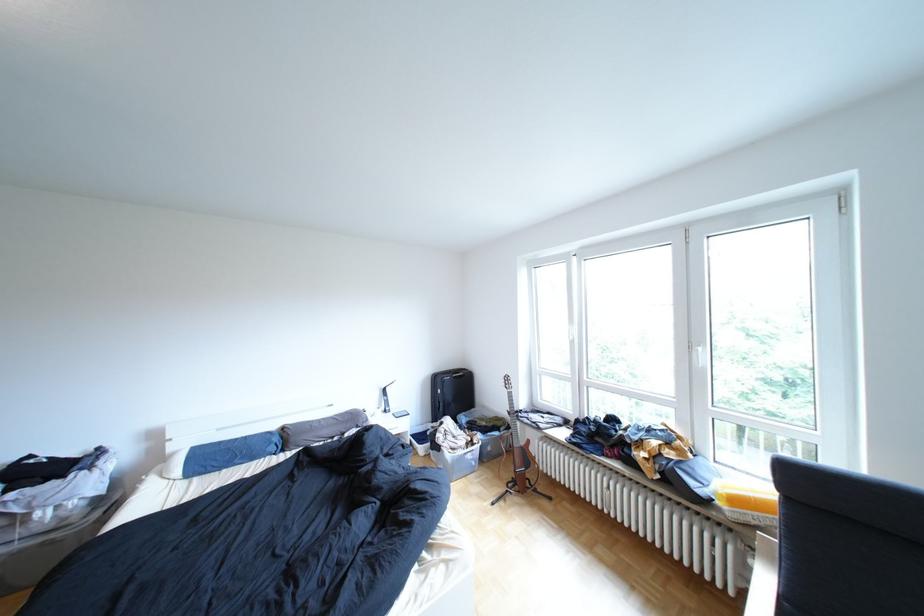
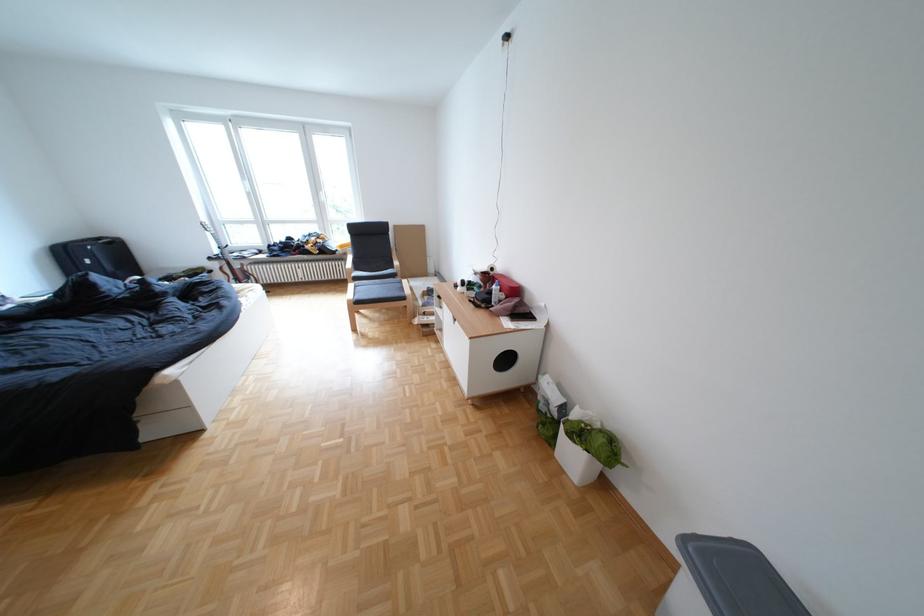
Question: I am providing you with two images of the same scene from different viewpoints. Which of the following objects are not visible in image2?

Choices:
 (A) grey bin lid
 (B) white plastic bin
 (C) small black bottle
 (D) white grocery bag

Answer: (B)